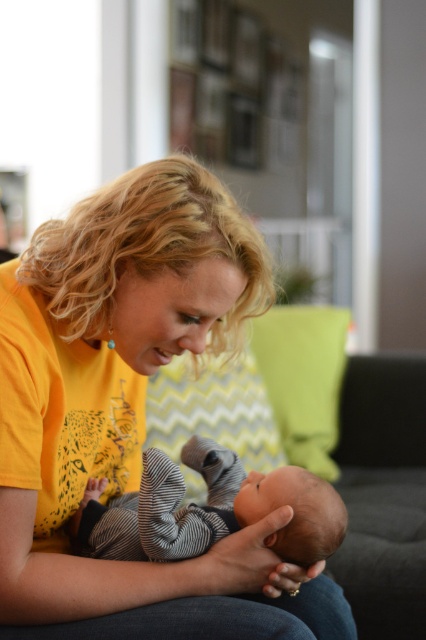
From the picture: Which is above, yellow matte shirt at center or striped cotton onesie at center?

Positioned higher is yellow matte shirt at center.

Between point (98, 461) and point (258, 512), which one is positioned in front?

Point (258, 512) is in front.

Is point (147, 339) in front of point (314, 541)?

Yes.

Where is `yellow matte shirt at center`? This screenshot has height=640, width=426. yellow matte shirt at center is located at coordinates (123, 404).

Which is more to the left, striped cotton onesie at center or yellow zigzag fabric pillow at center?

From the viewer's perspective, striped cotton onesie at center appears more on the left side.

Who is positioned more to the right, striped cotton onesie at center or yellow zigzag fabric pillow at center?

From the viewer's perspective, yellow zigzag fabric pillow at center appears more on the right side.

I want to click on striped cotton onesie at center, so click(x=210, y=509).

Where is `striped cotton onesie at center`? This screenshot has height=640, width=426. striped cotton onesie at center is located at coordinates (210, 509).

Between point (296, 476) and point (285, 310), which one is positioned in front?

Positioned in front is point (296, 476).

Which is below, striped cotton onesie at center or green zigzag fabric pillow at center?

Positioned lower is striped cotton onesie at center.

The image size is (426, 640). What do you see at coordinates (210, 509) in the screenshot? I see `striped cotton onesie at center` at bounding box center [210, 509].

Find the location of `striped cotton onesie at center`. striped cotton onesie at center is located at coordinates (210, 509).